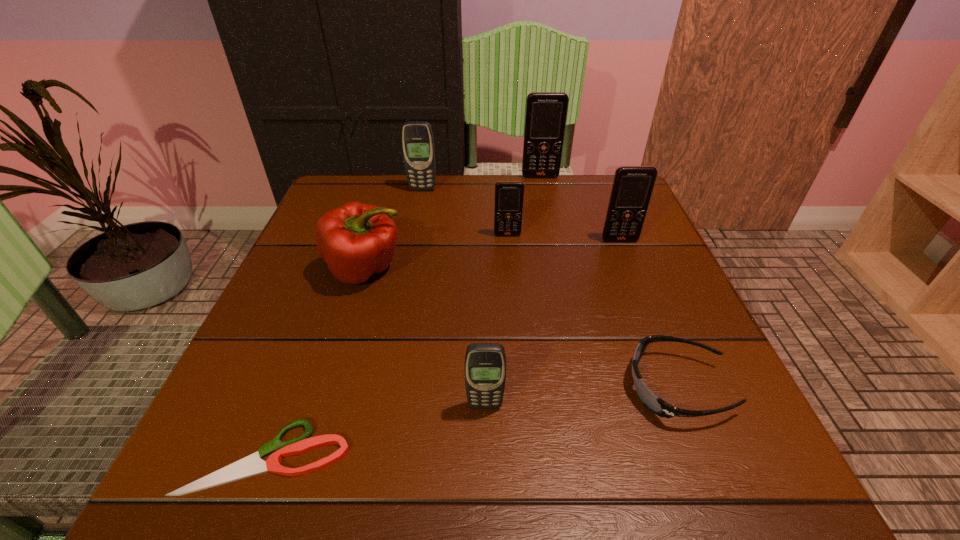
Identify the location of empty space that is in between the bell pepper and the farthest orange cellular telephone. This screenshot has width=960, height=540. (453, 224).

Find the location of a particular element. The image size is (960, 540). free space that is in between the shortest object and the sunglasses is located at coordinates (472, 422).

The height and width of the screenshot is (540, 960). Find the location of `free spot between the scissors and the nearest orange cellular telephone`. free spot between the scissors and the nearest orange cellular telephone is located at coordinates (444, 348).

This screenshot has height=540, width=960. I want to click on empty space that is in between the leftmost orange cellular telephone and the nearer gray cellular telephone, so click(496, 320).

Where is `vacant region between the smallest orange cellular telephone and the sunglasses`? The height and width of the screenshot is (540, 960). vacant region between the smallest orange cellular telephone and the sunglasses is located at coordinates (592, 311).

Where is `vacant area that lies between the right gray cellular telephone and the fifth farthest object`? The width and height of the screenshot is (960, 540). vacant area that lies between the right gray cellular telephone and the fifth farthest object is located at coordinates (425, 338).

Locate which object ranks sixth in proximity to the shortest object. Please provide its 2D coordinates. Your answer should be formatted as a tuple, i.e. [(x, y)], where the tuple contains the x and y coordinates of a point satisfying the conditions above.

[(417, 138)]

Point out which object is positioned as the nearest to the tallest cellular telephone. Please provide its 2D coordinates. Your answer should be formatted as a tuple, i.e. [(x, y)], where the tuple contains the x and y coordinates of a point satisfying the conditions above.

[(417, 138)]

Locate which cellular telephone ranks in proximity to the third nearest cellular telephone. Please provide its 2D coordinates. Your answer should be formatted as a tuple, i.e. [(x, y)], where the tuple contains the x and y coordinates of a point satisfying the conditions above.

[(632, 187)]

Where is `cellular telephone that stands as the closest to the second farthest object`? cellular telephone that stands as the closest to the second farthest object is located at coordinates (546, 112).